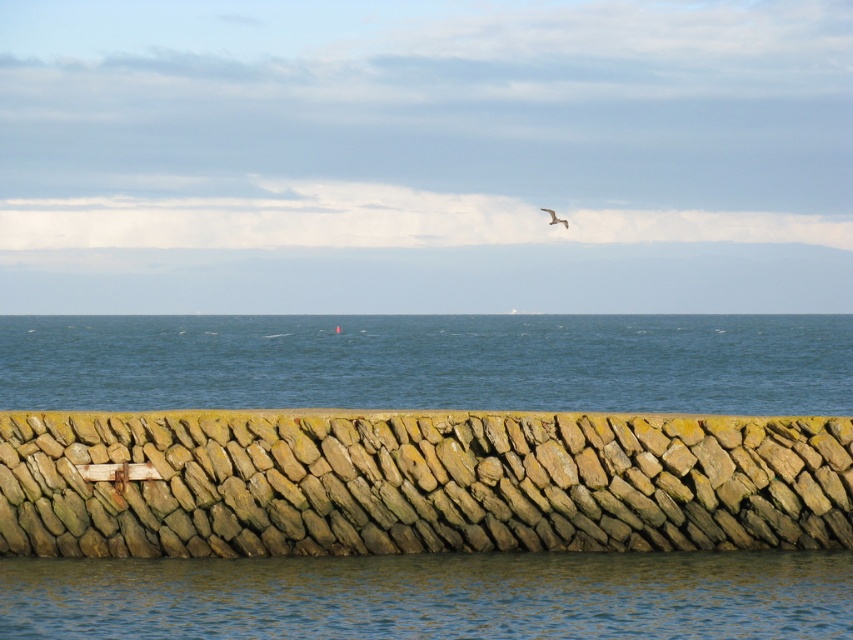
Is blue water at center positioned in front of blue water at lower center?

No, it is behind blue water at lower center.

Which is below, blue water at center or blue water at lower center?

Positioned lower is blue water at lower center.

Who is more forward, (817, 324) or (177, 602)?

Point (177, 602) is more forward.

Locate an element on the screen. blue water at center is located at coordinates (430, 362).

In the scene shown: Does yellowish stone wall at lower center have a larger size compared to blue water at center?

Incorrect, yellowish stone wall at lower center is not larger than blue water at center.

Image resolution: width=853 pixels, height=640 pixels. What do you see at coordinates (416, 483) in the screenshot?
I see `yellowish stone wall at lower center` at bounding box center [416, 483].

At what (x,y) coordinates should I click in order to perform the action: click on yellowish stone wall at lower center. Please return your answer as a coordinate pair (x, y). Looking at the image, I should click on (416, 483).

Between yellowish stone wall at lower center and blue water at lower center, which one has less height?

With less height is blue water at lower center.

Who is higher up, yellowish stone wall at lower center or blue water at lower center?

yellowish stone wall at lower center is above.

Where is `yellowish stone wall at lower center`? yellowish stone wall at lower center is located at coordinates (416, 483).